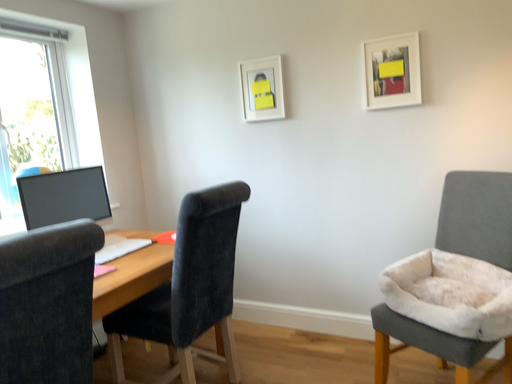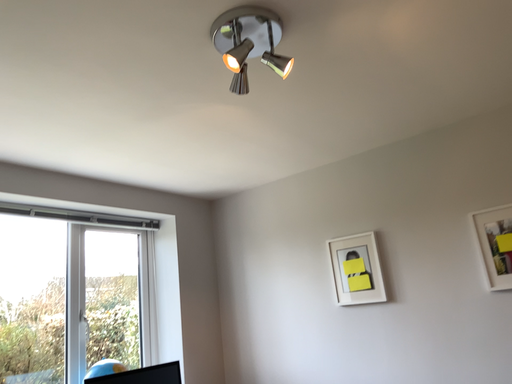
Question: Which way did the camera rotate in the video?

Choices:
 (A) rotated downward
 (B) rotated upward

Answer: (B)